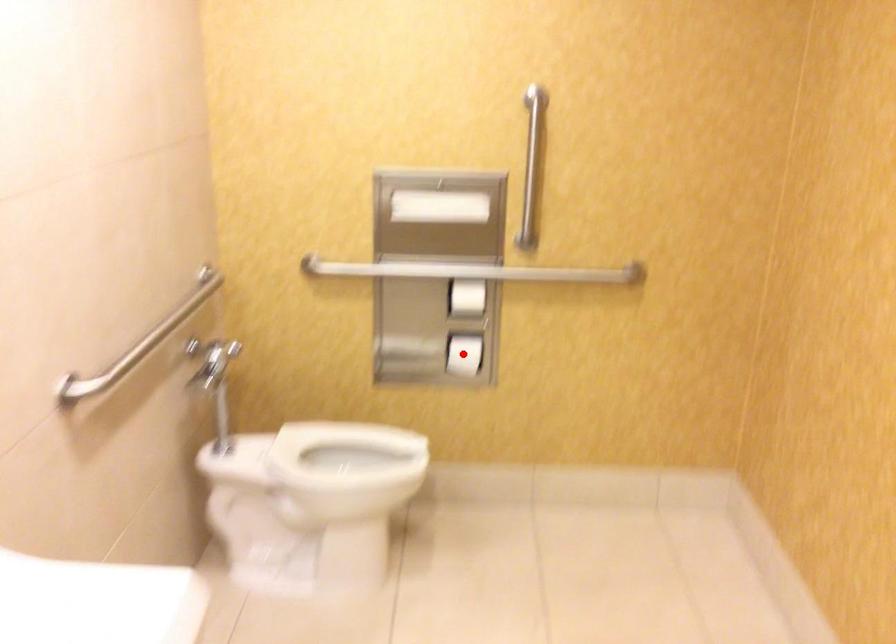
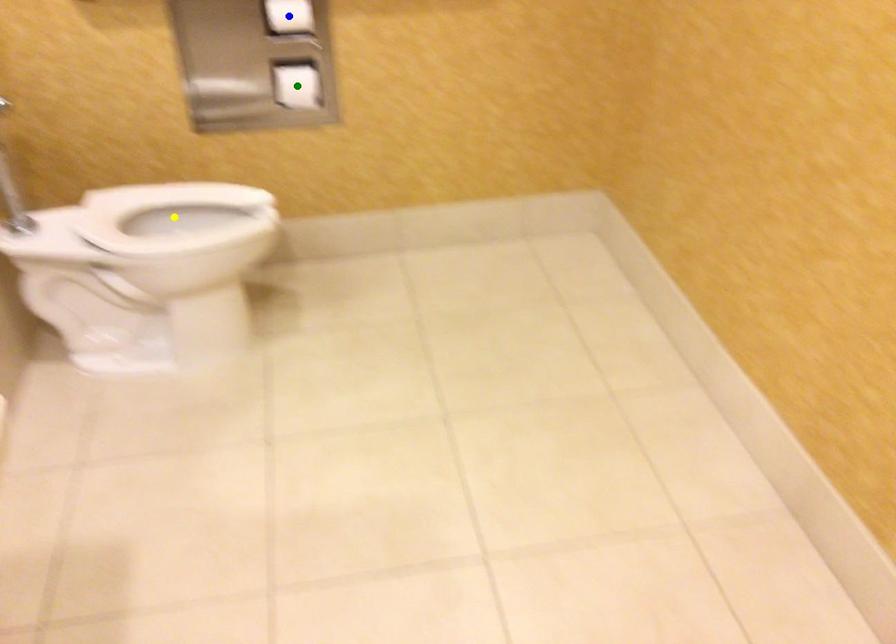
Question: I am providing you with two images of the same scene from different viewpoints. A red point is marked on the first image. You are given multiple points on the second image. In image 2, which mark is for the same physical point as the one in image 1?

Choices:
 (A) blue point
 (B) green point
 (C) yellow point

Answer: (B)